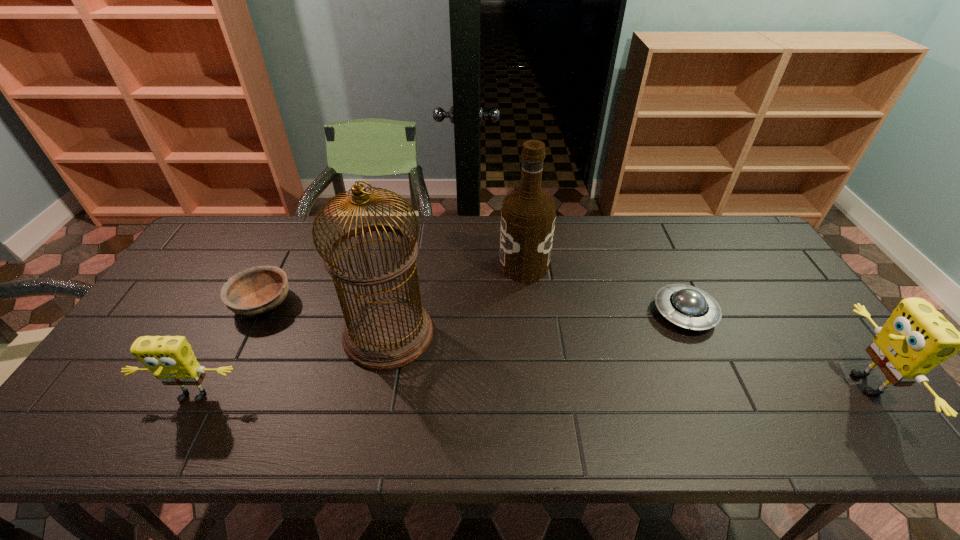
Find the location of a particular element. vacant space located on the face of the taller sponge is located at coordinates (713, 384).

Locate an element on the screen. The image size is (960, 540). free location located 0.070m on the right of the second object from right to left is located at coordinates (741, 313).

Locate an element on the screen. The image size is (960, 540). free space located on the label of the alcohol is located at coordinates (470, 265).

The image size is (960, 540). I want to click on free space located 0.370m on the label of the alcohol, so click(381, 265).

I want to click on free region located on the label of the alcohol, so click(420, 265).

Where is `vacant space located on the front-facing side of the fourth object from right to left`? The width and height of the screenshot is (960, 540). vacant space located on the front-facing side of the fourth object from right to left is located at coordinates (526, 334).

Find the location of a particular element. Image resolution: width=960 pixels, height=540 pixels. blank area located 0.260m on the right of the bowl is located at coordinates (383, 303).

Where is `object situated at the far edge`? object situated at the far edge is located at coordinates (528, 215).

The width and height of the screenshot is (960, 540). I want to click on object present at the left edge, so click(x=171, y=359).

The height and width of the screenshot is (540, 960). In order to click on object that is positioned at the right edge in this screenshot , I will do `click(916, 338)`.